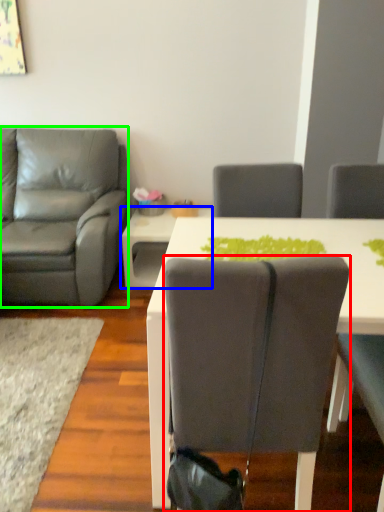
Question: Which is farther away from chair (highlighted by a red box)? table (highlighted by a blue box) or chair (highlighted by a green box)?

Choices:
 (A) table
 (B) chair

Answer: (A)